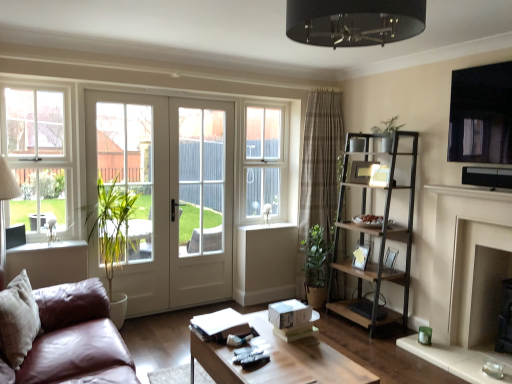
Question: From the image's perspective, does white wood window at upper left, which appears as the 2th window when viewed from the back, appear lower than brown wood/black metal shelf at right?

Choices:
 (A) yes
 (B) no

Answer: (B)

Question: Is the depth of white wood window at upper left, acting as the first window starting from the left, greater than that of brown wood/black metal shelf at right?

Choices:
 (A) no
 (B) yes

Answer: (A)

Question: Considering the relative sizes of white wood window at upper left, the second window in the right-to-left sequence, and brown wood/black metal shelf at right in the image provided, is white wood window at upper left, the second window in the right-to-left sequence, taller than brown wood/black metal shelf at right?

Choices:
 (A) no
 (B) yes

Answer: (A)

Question: Is white wood window at upper left, acting as the first window starting from the left, thinner than brown wood/black metal shelf at right?

Choices:
 (A) no
 (B) yes

Answer: (B)

Question: Is white wood window at upper left, which is the first window from front to back, positioned in front of brown wood/black metal shelf at right?

Choices:
 (A) yes
 (B) no

Answer: (A)

Question: Does white wood window at upper left, the second window in the right-to-left sequence, touch brown wood/black metal shelf at right?

Choices:
 (A) no
 (B) yes

Answer: (A)

Question: Could you tell me if matte black picture frame at right is turned towards brown wood/black metal shelf at right?

Choices:
 (A) yes
 (B) no

Answer: (A)

Question: Is matte black picture frame at right not inside brown wood/black metal shelf at right?

Choices:
 (A) yes
 (B) no

Answer: (B)

Question: From a real-world perspective, is matte black picture frame at right over brown wood/black metal shelf at right?

Choices:
 (A) no
 (B) yes

Answer: (A)

Question: Can you confirm if matte black picture frame at right is positioned to the right of brown wood/black metal shelf at right?

Choices:
 (A) yes
 (B) no

Answer: (A)

Question: Considering the relative sizes of matte black picture frame at right and brown wood/black metal shelf at right in the image provided, is matte black picture frame at right wider than brown wood/black metal shelf at right?

Choices:
 (A) yes
 (B) no

Answer: (B)

Question: From a real-world perspective, is matte black picture frame at right under brown wood/black metal shelf at right?

Choices:
 (A) no
 (B) yes

Answer: (B)

Question: Is matte black picture frame at right completely or partially inside white glossy door at center?

Choices:
 (A) yes
 (B) no

Answer: (B)